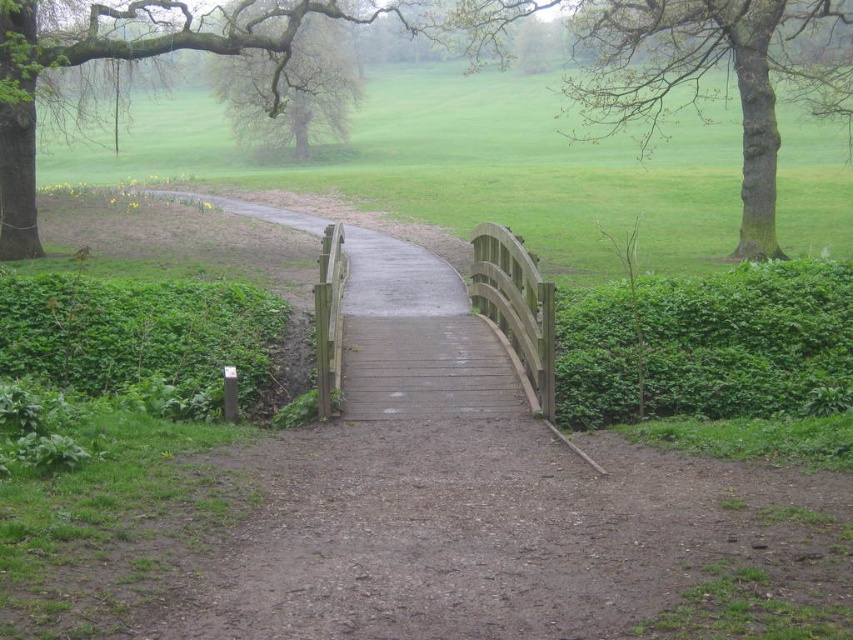
You are a park visitor wanting to take a photo of the green leafy hedge at right and the green rough bark tree at upper right. Which one should you stand closer to in order to capture both in a single frame?

To capture both the green leafy hedge at right and the green rough bark tree at upper right in a single frame, you should stand closer to the green leafy hedge at right since it is shorter than the green rough bark tree at upper right.

You are a park visitor who wants to take a photo of the green leafy hedge at right and the green rough bark tree at upper right. Which object should you position yourself to the right of to capture both in the frame?

You should position yourself to the right of the green rough bark tree at upper right to include both the green leafy hedge at right and the green rough bark tree at upper right in the photo frame, since the hedge is located to the left of the tree.

You are a gardener who needs to trim the green leafy hedge at right and the smooth brown tree at upper center. Which of these two plants requires more effort to trim due to its size?

The smooth brown tree at upper center requires more effort to trim because it is thicker than the green leafy hedge at right.